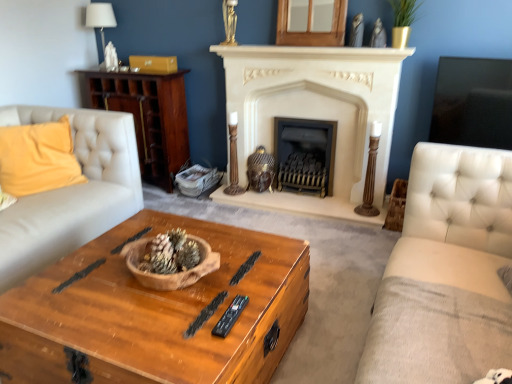
Question: From a real-world perspective, is wooden cabinet at left below wooden chest at center?

Choices:
 (A) no
 (B) yes

Answer: (A)

Question: From a real-world perspective, is wooden cabinet at left physically above wooden chest at center?

Choices:
 (A) yes
 (B) no

Answer: (A)

Question: Can you confirm if wooden cabinet at left is bigger than wooden chest at center?

Choices:
 (A) yes
 (B) no

Answer: (B)

Question: Does wooden cabinet at left appear on the left side of wooden chest at center?

Choices:
 (A) yes
 (B) no

Answer: (A)

Question: Does wooden cabinet at left come in front of wooden chest at center?

Choices:
 (A) no
 (B) yes

Answer: (A)

Question: Considering their positions, is white stone fireplace at center, marked as the first fireplace in a left-to-right arrangement, located in front of or behind yellow fabric pillow at left?

Choices:
 (A) front
 (B) behind

Answer: (B)

Question: Looking at the image, does white stone fireplace at center, which appears as the second fireplace when viewed from the right, seem bigger or smaller compared to yellow fabric pillow at left?

Choices:
 (A) big
 (B) small

Answer: (A)

Question: Based on their positions, is white stone fireplace at center, marked as the first fireplace in a left-to-right arrangement, located to the left or right of yellow fabric pillow at left?

Choices:
 (A) left
 (B) right

Answer: (B)

Question: Is white stone fireplace at center, marked as the first fireplace in a left-to-right arrangement, situated inside yellow fabric pillow at left or outside?

Choices:
 (A) inside
 (B) outside

Answer: (B)

Question: Is black plastic remote at center in front of or behind white tufted fabric studio couch at right in the image?

Choices:
 (A) behind
 (B) front

Answer: (A)

Question: From the image's perspective, is black plastic remote at center positioned above or below white tufted fabric studio couch at right?

Choices:
 (A) above
 (B) below

Answer: (A)

Question: Considering the relative positions of black plastic remote at center and white tufted fabric studio couch at right in the image provided, is black plastic remote at center to the left or to the right of white tufted fabric studio couch at right?

Choices:
 (A) left
 (B) right

Answer: (A)

Question: Does point (222, 317) appear closer or farther from the camera than point (437, 208)?

Choices:
 (A) closer
 (B) farther

Answer: (A)

Question: Is brown textured pine cone at center situated inside yellow fabric pillow at left or outside?

Choices:
 (A) outside
 (B) inside

Answer: (A)

Question: Is point (153, 251) closer or farther from the camera than point (46, 163)?

Choices:
 (A) closer
 (B) farther

Answer: (A)